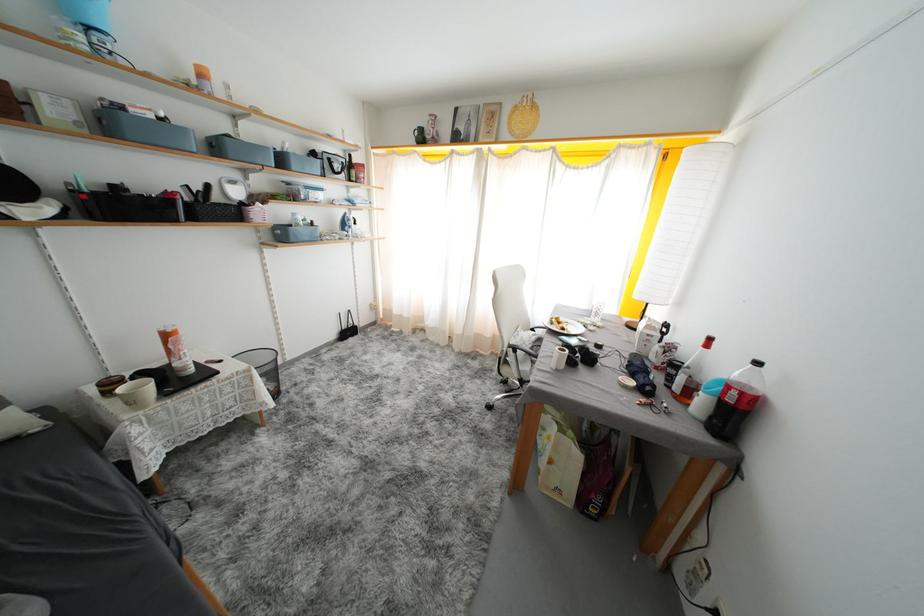
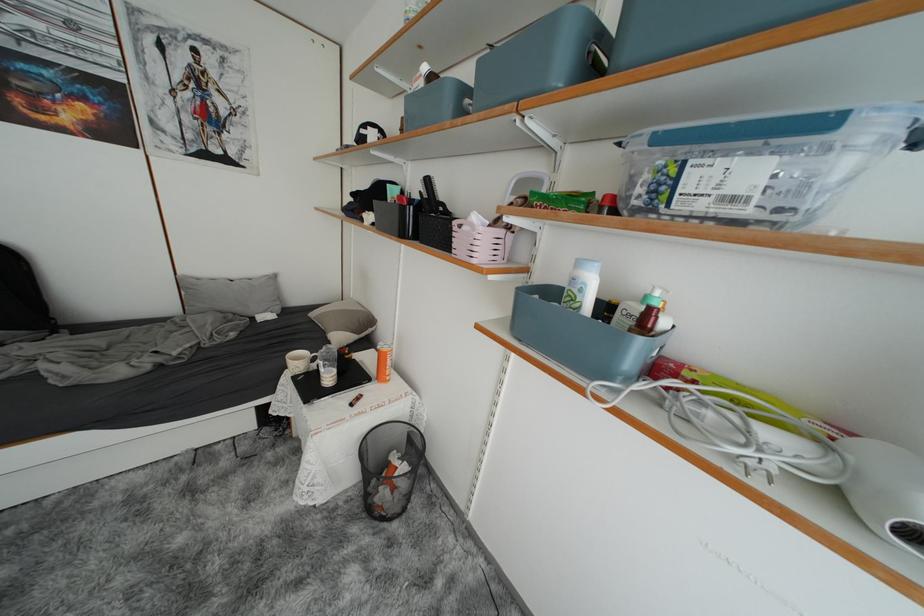
Find the pixel in the second image that matches (319,225) in the first image.

(657, 315)